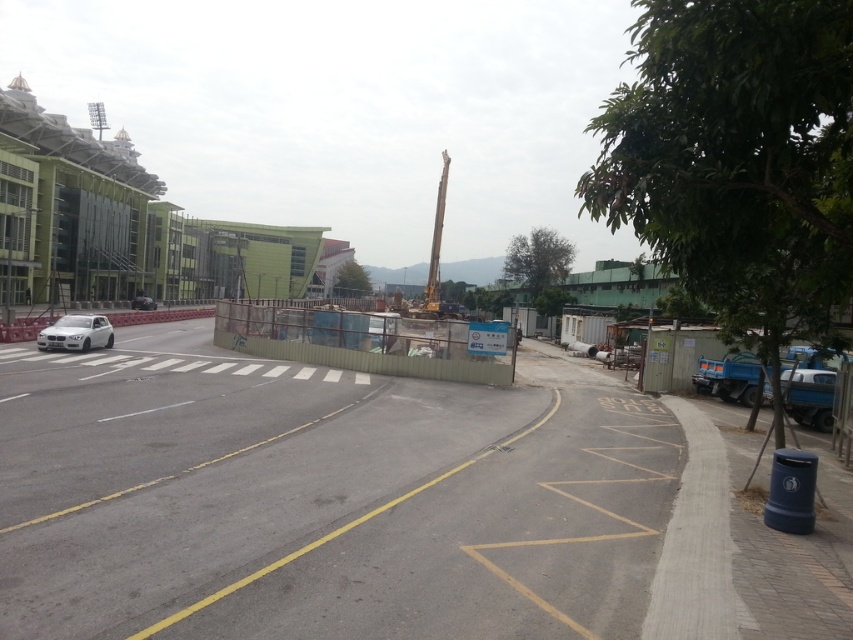
Between metallic yellow crane at center and satin silver sedan at left, which one has more height?

With more height is metallic yellow crane at center.

Who is more distant from viewer, [428,275] or [137,296]?

The point [137,296] is behind.

What do you see at coordinates (436, 243) in the screenshot?
I see `metallic yellow crane at center` at bounding box center [436, 243].

Where is `metallic yellow crane at center`? The image size is (853, 640). metallic yellow crane at center is located at coordinates (436, 243).

Looking at this image, how distant is metal fence at center from metallic yellow crane at center?

metal fence at center and metallic yellow crane at center are 44.50 meters apart from each other.

What do you see at coordinates (386, 502) in the screenshot? I see `metal fence at center` at bounding box center [386, 502].

Image resolution: width=853 pixels, height=640 pixels. What are the coordinates of `metal fence at center` in the screenshot? It's located at (386, 502).

Which of these two, sleek silver sedan at left or metallic yellow crane at center, stands taller?

metallic yellow crane at center is taller.

Who is positioned more to the left, sleek silver sedan at left or metallic yellow crane at center?

Positioned to the left is sleek silver sedan at left.

Does point (99, 332) come farther from viewer compared to point (439, 241)?

No, it is not.

Identify the location of sleek silver sedan at left. (76, 333).